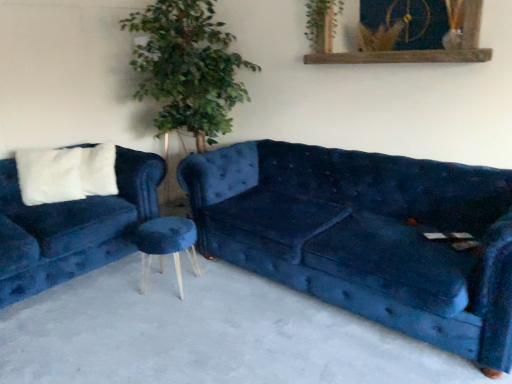
Identify the location of vacant space underneath velvet blue stool at center (from a real-world perspective). Image resolution: width=512 pixels, height=384 pixels. (181, 276).